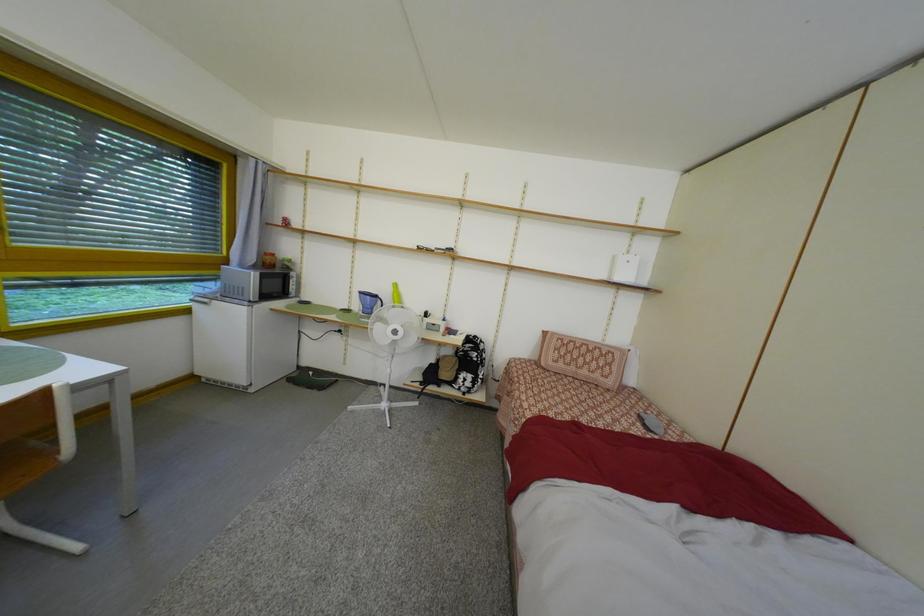
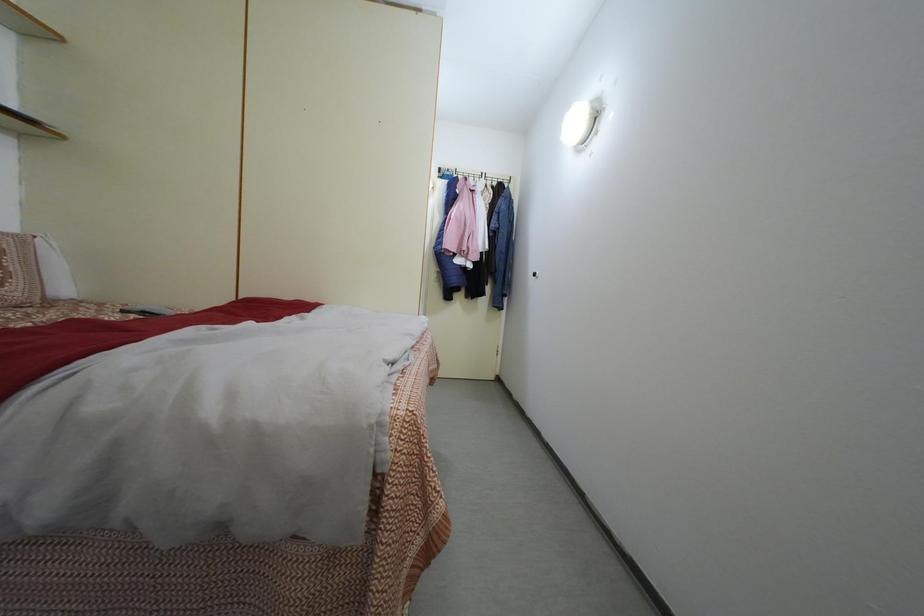
The images are taken continuously from a first-person perspective. In which direction is your viewpoint rotating?

The camera's rotation is toward right-down.